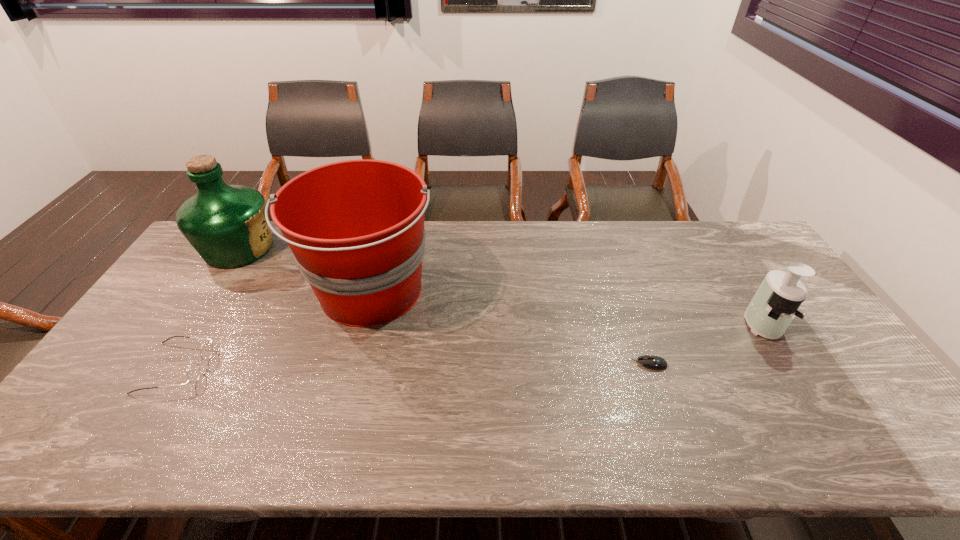
The image size is (960, 540). In order to click on unoccupied area between the computer mouse and the liquor in this screenshot , I will do `click(444, 306)`.

You are a GUI agent. You are given a task and a screenshot of the screen. Output one action in this format:
    pyautogui.click(x=<x>, y=<y>)
    Task: Click on the object that is the second closest to the second shortest object
    
    Given the screenshot: What is the action you would take?
    pyautogui.click(x=226, y=224)

In order to click on object that is the second nearest to the liquor in this screenshot , I will do `click(193, 373)`.

This screenshot has height=540, width=960. Identify the location of vacant area that satisfies the following two spatial constraints: 1. on the label side of the third shortest object; 2. on the right side of the liquor. (190, 324).

I want to click on vacant region that satisfies the following two spatial constraints: 1. on the label side of the liquor; 2. on the right side of the rightmost object, so click(x=190, y=324).

Locate an element on the screen. The width and height of the screenshot is (960, 540). free space in the image that satisfies the following two spatial constraints: 1. on the front side of the third tallest object; 2. through the lenses of the spectacles is located at coordinates (789, 368).

In order to click on vacant region that satisfies the following two spatial constraints: 1. on the back side of the shortest object; 2. on the label side of the liquor in this screenshot , I will do `click(610, 248)`.